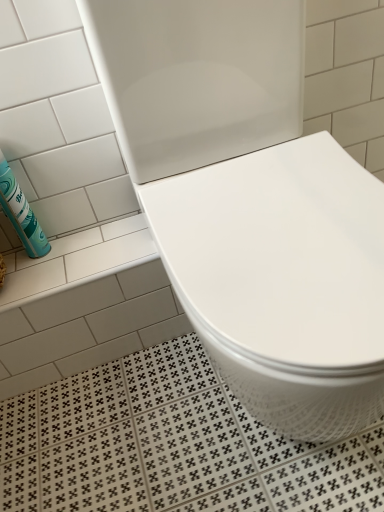
Question: Is white glossy toilet at center outside teal matte canister at left?

Choices:
 (A) yes
 (B) no

Answer: (A)

Question: Considering the relative sizes of white glossy toilet at center and teal matte canister at left in the image provided, is white glossy toilet at center thinner than teal matte canister at left?

Choices:
 (A) yes
 (B) no

Answer: (B)

Question: Does white glossy toilet at center lie in front of teal matte canister at left?

Choices:
 (A) yes
 (B) no

Answer: (A)

Question: From a real-world perspective, is white glossy toilet at center located beneath teal matte canister at left?

Choices:
 (A) no
 (B) yes

Answer: (B)

Question: Is white glossy toilet at center facing away from teal matte canister at left?

Choices:
 (A) no
 (B) yes

Answer: (A)

Question: Is white glossy toilet at center facing towards teal matte canister at left?

Choices:
 (A) yes
 (B) no

Answer: (B)

Question: Does teal matte canister at left touch white glossy toilet at center?

Choices:
 (A) no
 (B) yes

Answer: (A)

Question: From a real-world perspective, is teal matte canister at left under white glossy toilet at center?

Choices:
 (A) no
 (B) yes

Answer: (A)

Question: From a real-world perspective, does teal matte canister at left stand above white glossy toilet at center?

Choices:
 (A) yes
 (B) no

Answer: (A)

Question: Can white glossy toilet at center be found inside teal matte canister at left?

Choices:
 (A) no
 (B) yes

Answer: (A)

Question: Does teal matte canister at left have a greater width compared to white glossy toilet at center?

Choices:
 (A) no
 (B) yes

Answer: (A)

Question: Can you confirm if teal matte canister at left is shorter than white glossy toilet at center?

Choices:
 (A) no
 (B) yes

Answer: (B)

Question: From the image's perspective, is white glossy toilet at center located above or below teal matte canister at left?

Choices:
 (A) above
 (B) below

Answer: (B)